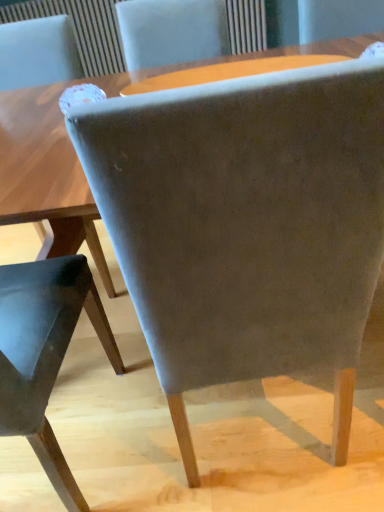
This screenshot has width=384, height=512. Describe the element at coordinates (44, 352) in the screenshot. I see `suede gray chair at center, the second chair positioned from the right` at that location.

What do you see at coordinates (246, 225) in the screenshot?
I see `suede-like gray chair at center, which is counted as the 1th chair, starting from the right` at bounding box center [246, 225].

Where is `suede gray chair at center, the first chair viewed from the left`? The width and height of the screenshot is (384, 512). suede gray chair at center, the first chair viewed from the left is located at coordinates (44, 352).

Which of these two, matte wooden table at upper center or suede gray chair at center, the first chair viewed from the left, stands shorter?

matte wooden table at upper center is shorter.

Considering the positions of objects matte wooden table at upper center and suede gray chair at center, the first chair viewed from the left, in the image provided, who is in front, matte wooden table at upper center or suede gray chair at center, the first chair viewed from the left,?

suede gray chair at center, the first chair viewed from the left, is more forward.

Does point (326, 56) come in front of point (22, 295)?

That is False.

Is matte wooden table at upper center bigger or smaller than suede gray chair at center, the first chair viewed from the left?

Clearly, matte wooden table at upper center is smaller in size than suede gray chair at center, the first chair viewed from the left.

This screenshot has height=512, width=384. Identify the location of chair on the left of suede-like gray chair at center, which is counted as the 1th chair, starting from the right. (44, 352).

Consider the image. From a real-world perspective, who is located lower, suede gray chair at center, the second chair positioned from the right, or suede-like gray chair at center, the 2th chair viewed from the left?

suede gray chair at center, the second chair positioned from the right.

Does suede gray chair at center, the first chair viewed from the left, turn towards suede-like gray chair at center, the 2th chair viewed from the left?

No, suede gray chair at center, the first chair viewed from the left, is not facing towards suede-like gray chair at center, the 2th chair viewed from the left.

Does point (5, 392) appear closer or farther from the camera than point (159, 88)?

Point (5, 392) is closer to the camera than point (159, 88).

From the image's perspective, is suede gray chair at center, the first chair viewed from the left, on matte wooden table at upper center?

Actually, suede gray chair at center, the first chair viewed from the left, appears below matte wooden table at upper center in the image.

Is suede gray chair at center, the first chair viewed from the left, shorter than matte wooden table at upper center?

Incorrect, the height of suede gray chair at center, the first chair viewed from the left, does not fall short of that of matte wooden table at upper center.

Is suede gray chair at center, the second chair positioned from the right, positioned with its back to matte wooden table at upper center?

No, matte wooden table at upper center is not at the back of suede gray chair at center, the second chair positioned from the right.

Is suede-like gray chair at center, the 2th chair viewed from the left, turned away from suede gray chair at center, the first chair viewed from the left?

No, suede-like gray chair at center, the 2th chair viewed from the left, is not facing the opposite direction of suede gray chair at center, the first chair viewed from the left.

From the image's perspective, relative to suede gray chair at center, the second chair positioned from the right, is suede-like gray chair at center, which is counted as the 1th chair, starting from the right, above or below?

Clearly, from the image's perspective, suede-like gray chair at center, which is counted as the 1th chair, starting from the right, is above suede gray chair at center, the second chair positioned from the right.

Is suede-like gray chair at center, which is counted as the 1th chair, starting from the right, at the left side of suede gray chair at center, the first chair viewed from the left?

Incorrect, suede-like gray chair at center, which is counted as the 1th chair, starting from the right, is not on the left side of suede gray chair at center, the first chair viewed from the left.

Find the location of a particular element. This screenshot has width=384, height=512. chair above the suede gray chair at center, the second chair positioned from the right (from a real-world perspective) is located at coordinates (246, 225).

From the image's perspective, is matte wooden table at upper center on suede-like gray chair at center, which is counted as the 1th chair, starting from the right?

Indeed, from the image's perspective, matte wooden table at upper center is shown above suede-like gray chair at center, which is counted as the 1th chair, starting from the right.

Is matte wooden table at upper center facing away from suede-like gray chair at center, the 2th chair viewed from the left?

No, matte wooden table at upper center is not facing the opposite direction of suede-like gray chair at center, the 2th chair viewed from the left.

Are matte wooden table at upper center and suede-like gray chair at center, which is counted as the 1th chair, starting from the right, making contact?

No, matte wooden table at upper center is not making contact with suede-like gray chair at center, which is counted as the 1th chair, starting from the right.

Considering the positions of objects matte wooden table at upper center and suede-like gray chair at center, which is counted as the 1th chair, starting from the right, in the image provided, who is more to the right, matte wooden table at upper center or suede-like gray chair at center, which is counted as the 1th chair, starting from the right,?

Positioned to the right is matte wooden table at upper center.

Is suede-like gray chair at center, the 2th chair viewed from the left, looking in the opposite direction of matte wooden table at upper center?

No.

Considering the sizes of suede-like gray chair at center, which is counted as the 1th chair, starting from the right, and matte wooden table at upper center in the image, is suede-like gray chair at center, which is counted as the 1th chair, starting from the right, taller or shorter than matte wooden table at upper center?

Clearly, suede-like gray chair at center, which is counted as the 1th chair, starting from the right, is taller compared to matte wooden table at upper center.

Locate an element on the screen. the 1st chair below the matte wooden table at upper center (from a real-world perspective) is located at coordinates (246, 225).

Is suede-like gray chair at center, which is counted as the 1th chair, starting from the right, wider than matte wooden table at upper center?

Yes.

From a real-world perspective, count 2nd chairs downward from the matte wooden table at upper center and point to it. Please provide its 2D coordinates.

[(44, 352)]

I want to click on chair behind the suede-like gray chair at center, the 2th chair viewed from the left, so click(x=44, y=352).

From the picture: Which object lies further to the anchor point matte wooden table at upper center, suede gray chair at center, the first chair viewed from the left, or suede-like gray chair at center, which is counted as the 1th chair, starting from the right?

Based on the image, suede-like gray chair at center, which is counted as the 1th chair, starting from the right, appears to be further to matte wooden table at upper center.

Looking at the image, which one is located further to matte wooden table at upper center, suede-like gray chair at center, the 2th chair viewed from the left, or suede gray chair at center, the second chair positioned from the right?

Among the two, suede-like gray chair at center, the 2th chair viewed from the left, is located further to matte wooden table at upper center.

When comparing their distances from suede-like gray chair at center, the 2th chair viewed from the left, does suede gray chair at center, the first chair viewed from the left, or matte wooden table at upper center seem closer?

suede gray chair at center, the first chair viewed from the left, is positioned closer to the anchor suede-like gray chair at center, the 2th chair viewed from the left.

When comparing their distances from suede-like gray chair at center, the 2th chair viewed from the left, does matte wooden table at upper center or suede gray chair at center, the first chair viewed from the left, seem further?

Among the two, matte wooden table at upper center is located further to suede-like gray chair at center, the 2th chair viewed from the left.

Which object lies nearer to the anchor point suede gray chair at center, the second chair positioned from the right, suede-like gray chair at center, which is counted as the 1th chair, starting from the right, or matte wooden table at upper center?

suede-like gray chair at center, which is counted as the 1th chair, starting from the right, is positioned closer to the anchor suede gray chair at center, the second chair positioned from the right.

When comparing their distances from suede gray chair at center, the first chair viewed from the left, does matte wooden table at upper center or suede-like gray chair at center, the 2th chair viewed from the left, seem further?

matte wooden table at upper center is further to suede gray chair at center, the first chair viewed from the left.

Find the location of a particular element. Image resolution: width=384 pixels, height=512 pixels. chair positioned between suede-like gray chair at center, the 2th chair viewed from the left, and matte wooden table at upper center from near to far is located at coordinates (44, 352).